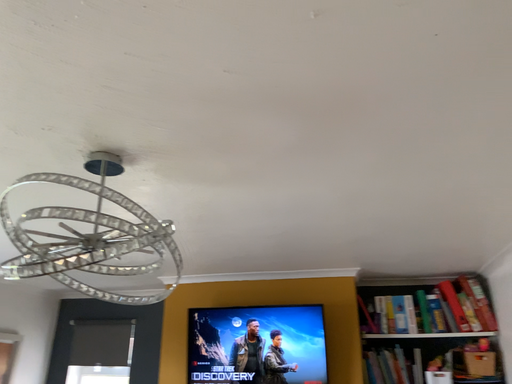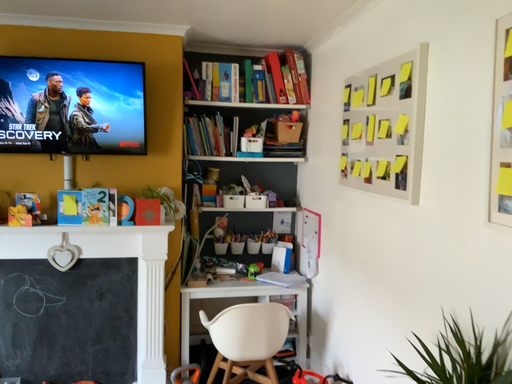
Question: Which way did the camera rotate in the video?

Choices:
 (A) rotated left
 (B) rotated right

Answer: (B)